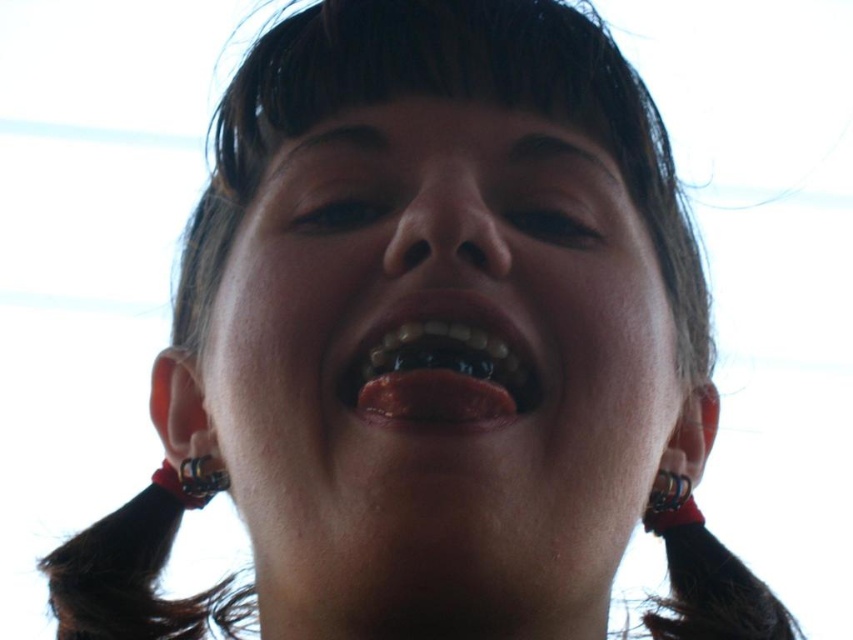
Question: Which point appears farthest from the camera in this image?

Choices:
 (A) (479, 358)
 (B) (387, 193)
 (C) (215, 470)

Answer: (C)

Question: Is the position of silver metallic ring at lower left more distant than that of metallic silver braces at lower right?

Choices:
 (A) no
 (B) yes

Answer: (A)

Question: Which of the following is the closest to the observer?

Choices:
 (A) silver metallic ring at lower left
 (B) smooth skin face at center

Answer: (B)

Question: Is shiny white teeth at center to the left of metallic silver braces at lower right from the viewer's perspective?

Choices:
 (A) yes
 (B) no

Answer: (A)

Question: Which point appears closest to the camera in this image?

Choices:
 (A) (395, 369)
 (B) (181, 461)
 (C) (302, 284)

Answer: (A)

Question: Is the position of smooth skin face at center more distant than that of silver metallic ring at lower left?

Choices:
 (A) no
 (B) yes

Answer: (A)